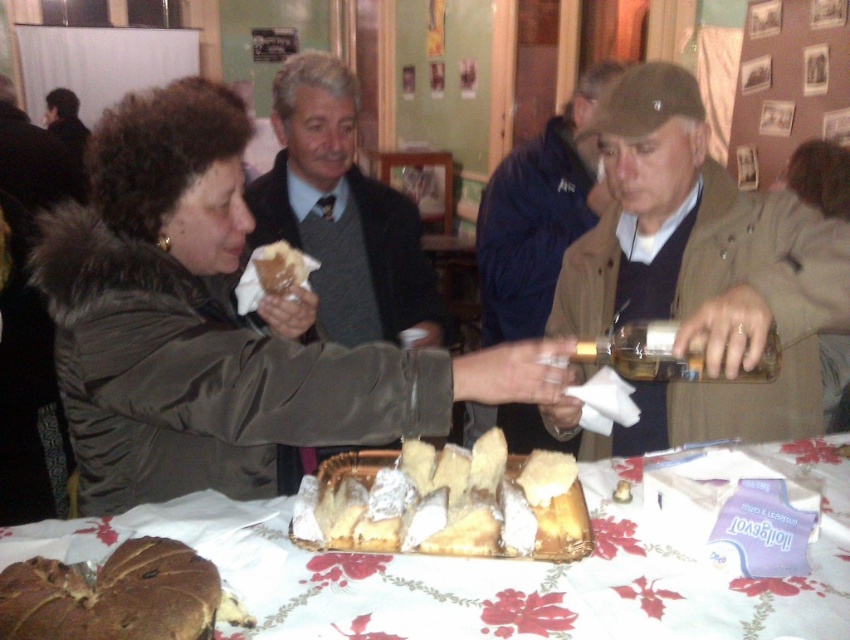
Question: Which point is farther to the camera?

Choices:
 (A) white floral tablecloth at lower center
 (B) brown leather jacket at right

Answer: (B)

Question: Which of these objects is positioned closest to the matte green jacket at left?

Choices:
 (A) translucent glass bottle at center
 (B) dark gray sweater at center
 (C) brown leather jacket at upper center

Answer: (A)

Question: Among these points, which one is nearest to the camera?

Choices:
 (A) (208, 259)
 (B) (571, 157)
 (C) (353, 636)
 (D) (670, 368)

Answer: (C)

Question: Does brown crumbly pastry at lower left lie behind white crumbly bread at center?

Choices:
 (A) no
 (B) yes

Answer: (A)

Question: Is white floral tablecloth at lower center positioned at the back of powdery white cheese at center?

Choices:
 (A) yes
 (B) no

Answer: (B)

Question: Does white floral tablecloth at lower center appear under brown leather jacket at right?

Choices:
 (A) yes
 (B) no

Answer: (A)